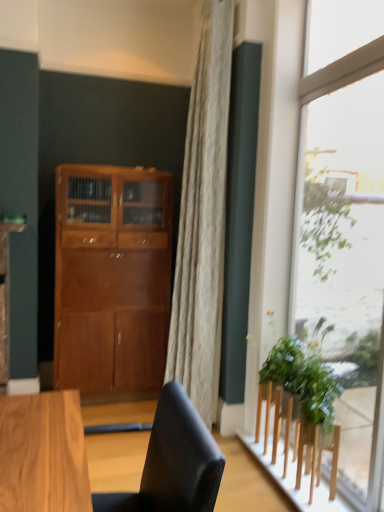
Question: Considering the positions of green leafy plant at right and matte black chair at lower center in the image, is green leafy plant at right bigger or smaller than matte black chair at lower center?

Choices:
 (A) small
 (B) big

Answer: (A)

Question: From a real-world perspective, relative to matte black chair at lower center, is green leafy plant at right vertically above or below?

Choices:
 (A) below
 (B) above

Answer: (A)

Question: Estimate the real-world distances between objects in this image. Which object is farther from the matte black chair at lower center?

Choices:
 (A) wooden stool at lower right
 (B) green leafy plant at right
 (C) matte wood cabinet at center
 (D) transparent glass window at right

Answer: (D)

Question: Which object is positioned closest to the green leafy plant at right?

Choices:
 (A) matte wood cabinet at center
 (B) transparent glass window at right
 (C) wooden stool at lower right
 (D) matte black chair at lower center

Answer: (C)